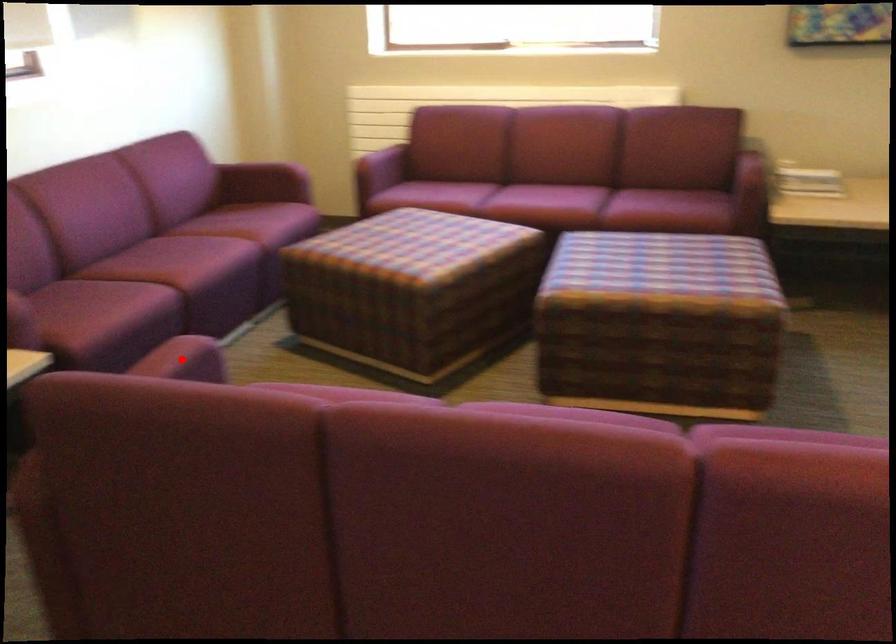
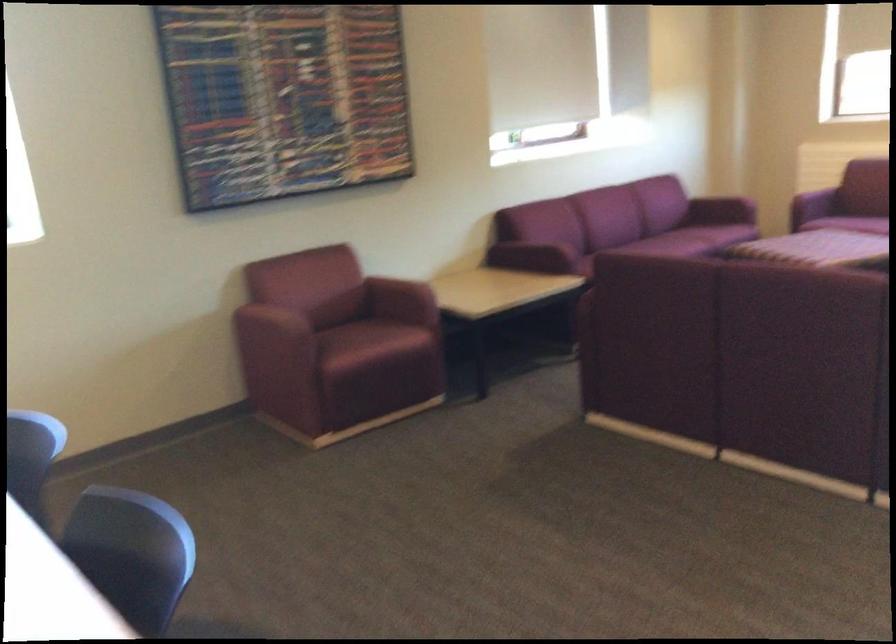
Question: I am providing you with two images of the same scene from different viewpoints. A red point is marked on the first image. Is the red point's position out of view in image 2?

Choices:
 (A) Yes
 (B) No

Answer: (A)